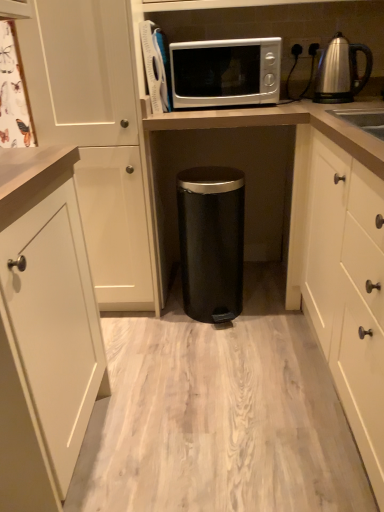
Question: Is the surface of black matte trash can at center, placed as the first appliance when sorted from right to left, in direct contact with satin silver microwave at upper center, the 2th appliance from the right?

Choices:
 (A) no
 (B) yes

Answer: (A)

Question: Can we say black matte trash can at center, which is counted as the second appliance, starting from the top, lies outside satin silver microwave at upper center, the first appliance from the top?

Choices:
 (A) yes
 (B) no

Answer: (A)

Question: Does black matte trash can at center, acting as the second appliance starting from the left, have a lesser height compared to satin silver microwave at upper center, the second appliance positioned from the bottom?

Choices:
 (A) no
 (B) yes

Answer: (A)

Question: Can you confirm if black matte trash can at center, which is counted as the second appliance, starting from the top, is wider than satin silver microwave at upper center, the 2th appliance from the right?

Choices:
 (A) yes
 (B) no

Answer: (B)

Question: Is black matte trash can at center, which is the 1th appliance in bottom-to-top order, not close to satin silver microwave at upper center, the second appliance positioned from the bottom?

Choices:
 (A) no
 (B) yes

Answer: (A)

Question: Based on their sizes in the image, would you say satin silver kettle at upper right is bigger or smaller than white matte cabinet at right, acting as the 2th cabinetry starting from the left?

Choices:
 (A) big
 (B) small

Answer: (B)

Question: Which is correct: satin silver kettle at upper right is inside white matte cabinet at right, which appears as the first cabinetry when viewed from the right, or outside of it?

Choices:
 (A) outside
 (B) inside

Answer: (B)

Question: From a real-world perspective, is satin silver kettle at upper right positioned above or below white matte cabinet at right, which appears as the first cabinetry when viewed from the right?

Choices:
 (A) below
 (B) above

Answer: (B)

Question: Looking at their shapes, would you say satin silver kettle at upper right is wider or thinner than white matte cabinet at right, acting as the 2th cabinetry starting from the left?

Choices:
 (A) wide
 (B) thin

Answer: (B)

Question: Based on their sizes in the image, would you say satin silver kettle at upper right is bigger or smaller than black matte trash can at center, which is the 1th appliance in bottom-to-top order?

Choices:
 (A) small
 (B) big

Answer: (A)

Question: In terms of width, does satin silver kettle at upper right look wider or thinner when compared to black matte trash can at center, placed as the first appliance when sorted from right to left?

Choices:
 (A) wide
 (B) thin

Answer: (B)

Question: From the image's perspective, is satin silver kettle at upper right above or below black matte trash can at center, acting as the second appliance starting from the left?

Choices:
 (A) above
 (B) below

Answer: (A)

Question: From a real-world perspective, is satin silver kettle at upper right above or below black matte trash can at center, acting as the second appliance starting from the left?

Choices:
 (A) below
 (B) above

Answer: (B)

Question: Is satin silver microwave at upper center inside the boundaries of white matte cabinet at right, which appears as the first cabinetry when viewed from the right, or outside?

Choices:
 (A) outside
 (B) inside

Answer: (A)

Question: From a real-world perspective, is satin silver microwave at upper center above or below white matte cabinet at right, acting as the 2th cabinetry starting from the left?

Choices:
 (A) below
 (B) above

Answer: (B)